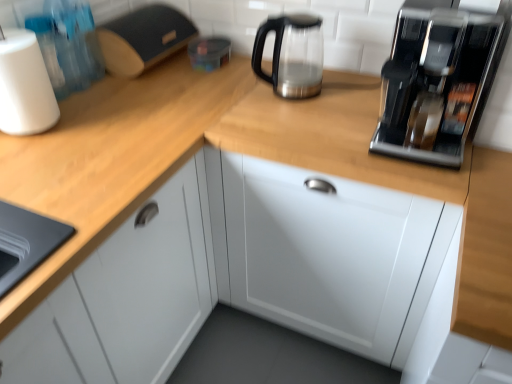
Where is `free space above white glossy cabinet at center (from a real-world perspective)`? The image size is (512, 384). free space above white glossy cabinet at center (from a real-world perspective) is located at coordinates (334, 111).